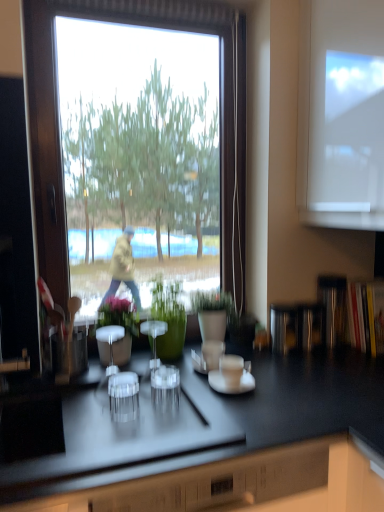
Question: Is transparent plastic shot glass at center surrounded by green matte plant at center, which is counted as the 1th houseplant, starting from the right?

Choices:
 (A) yes
 (B) no

Answer: (B)

Question: Considering the relative sizes of green matte plant at center, arranged as the 3th houseplant when viewed from the left, and transparent plastic shot glass at center in the image provided, is green matte plant at center, arranged as the 3th houseplant when viewed from the left, taller than transparent plastic shot glass at center?

Choices:
 (A) yes
 (B) no

Answer: (A)

Question: Is there a large distance between green matte plant at center, which is counted as the 1th houseplant, starting from the right, and transparent plastic shot glass at center?

Choices:
 (A) yes
 (B) no

Answer: (B)

Question: From a real-world perspective, is green matte plant at center, arranged as the 3th houseplant when viewed from the left, physically below transparent plastic shot glass at center?

Choices:
 (A) no
 (B) yes

Answer: (A)

Question: Does green matte plant at center, which is counted as the 1th houseplant, starting from the right, have a larger size compared to transparent plastic shot glass at center?

Choices:
 (A) no
 (B) yes

Answer: (B)

Question: Considering the positions of green matte vase at center, which is the second houseplant in left-to-right order, and clear glass salt shaker at center in the image, is green matte vase at center, which is the second houseplant in left-to-right order, taller or shorter than clear glass salt shaker at center?

Choices:
 (A) short
 (B) tall

Answer: (B)

Question: Considering the positions of green matte vase at center, which is the second houseplant in left-to-right order, and clear glass salt shaker at center in the image, is green matte vase at center, which is the second houseplant in left-to-right order, bigger or smaller than clear glass salt shaker at center?

Choices:
 (A) big
 (B) small

Answer: (A)

Question: From a real-world perspective, is green matte vase at center, which is the second houseplant in left-to-right order, physically located above or below clear glass salt shaker at center?

Choices:
 (A) below
 (B) above

Answer: (B)

Question: Considering the relative positions of green matte vase at center, placed as the 2th houseplant when sorted from right to left, and clear glass salt shaker at center in the image provided, is green matte vase at center, placed as the 2th houseplant when sorted from right to left, to the left or to the right of clear glass salt shaker at center?

Choices:
 (A) right
 (B) left

Answer: (A)

Question: Considering their positions, is green matte plant at center, which is counted as the 1th houseplant, starting from the right, located in front of or behind white glossy saucer at center?

Choices:
 (A) behind
 (B) front

Answer: (A)

Question: From the image's perspective, relative to white glossy saucer at center, is green matte plant at center, which is counted as the 1th houseplant, starting from the right, above or below?

Choices:
 (A) below
 (B) above

Answer: (B)

Question: From a real-world perspective, is green matte plant at center, arranged as the 3th houseplant when viewed from the left, positioned above or below white glossy saucer at center?

Choices:
 (A) above
 (B) below

Answer: (A)

Question: In terms of height, does green matte plant at center, which is counted as the 1th houseplant, starting from the right, look taller or shorter compared to white glossy saucer at center?

Choices:
 (A) tall
 (B) short

Answer: (A)

Question: Does point (150, 365) appear closer or farther from the camera than point (205, 302)?

Choices:
 (A) farther
 (B) closer

Answer: (B)

Question: Is clear glass salt shaker at center inside or outside of green matte plant at center, which is counted as the 1th houseplant, starting from the right?

Choices:
 (A) inside
 (B) outside

Answer: (B)